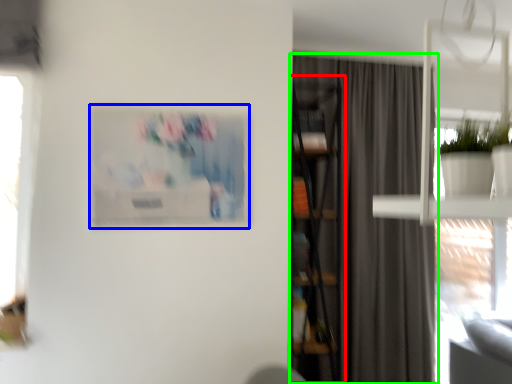
Question: Which object is the closest to the bookcase (highlighted by a red box)? Choose among these: picture frame (highlighted by a blue box) or curtain (highlighted by a green box).

Choices:
 (A) picture frame
 (B) curtain

Answer: (B)